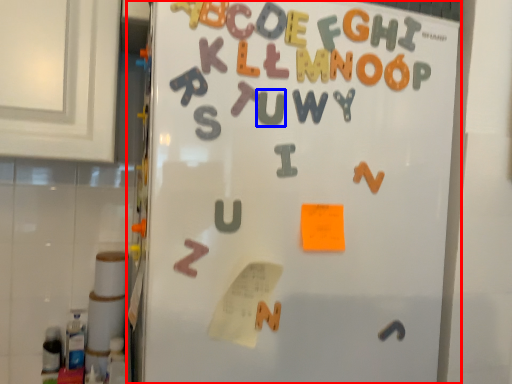
Question: Among these objects, which one is nearest to the camera, refrigerator (highlighted by a red box) or letter (highlighted by a blue box)?

Choices:
 (A) refrigerator
 (B) letter

Answer: (A)